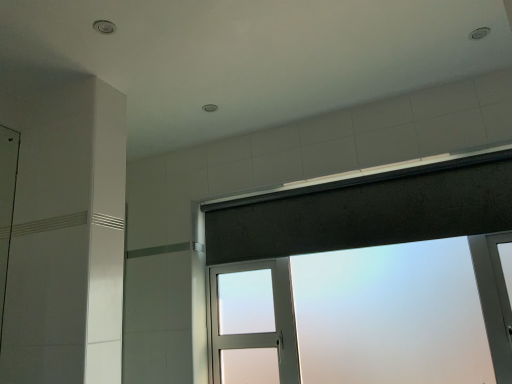
Question: Can you confirm if frosted glass window at upper center is positioned to the right of dark gray fabric at upper center?

Choices:
 (A) no
 (B) yes

Answer: (B)

Question: Is dark gray fabric at upper center inside frosted glass window at upper center?

Choices:
 (A) no
 (B) yes

Answer: (B)

Question: Does frosted glass window at upper center come behind dark gray fabric at upper center?

Choices:
 (A) yes
 (B) no

Answer: (B)

Question: Does frosted glass window at upper center have a lesser height compared to dark gray fabric at upper center?

Choices:
 (A) yes
 (B) no

Answer: (B)

Question: From the image's perspective, does frosted glass window at upper center appear higher than dark gray fabric at upper center?

Choices:
 (A) yes
 (B) no

Answer: (B)

Question: Can you confirm if frosted glass window at upper center is thinner than dark gray fabric at upper center?

Choices:
 (A) yes
 (B) no

Answer: (B)

Question: Is dark gray fabric at upper center outside of frosted glass window at upper center?

Choices:
 (A) yes
 (B) no

Answer: (B)

Question: Can you confirm if dark gray fabric at upper center is smaller than frosted glass window at upper center?

Choices:
 (A) yes
 (B) no

Answer: (A)

Question: Is dark gray fabric at upper center to the left of frosted glass window at upper center from the viewer's perspective?

Choices:
 (A) yes
 (B) no

Answer: (A)

Question: Considering the relative sizes of dark gray fabric at upper center and frosted glass window at upper center in the image provided, is dark gray fabric at upper center wider than frosted glass window at upper center?

Choices:
 (A) no
 (B) yes

Answer: (A)

Question: Does dark gray fabric at upper center come behind frosted glass window at upper center?

Choices:
 (A) no
 (B) yes

Answer: (B)

Question: Is dark gray fabric at upper center thinner than frosted glass window at upper center?

Choices:
 (A) yes
 (B) no

Answer: (A)

Question: From the image's perspective, is dark gray fabric at upper center located above or below frosted glass window at upper center?

Choices:
 (A) above
 (B) below

Answer: (A)